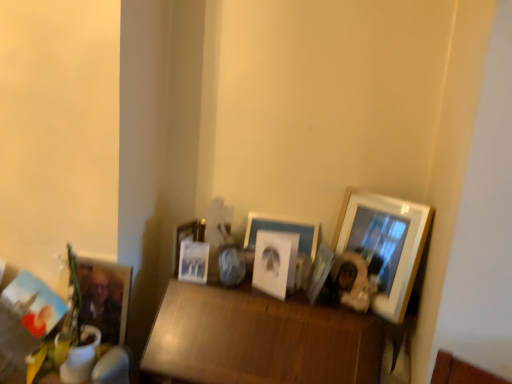
Question: Which direction should I rotate to face white paper at center, which is counted as the third picture frame, starting from the right, — up or down?

Choices:
 (A) up
 (B) down

Answer: (B)

Question: From the image's perspective, is metallic silver photo frame at center, the 5th picture frame positioned from the right, located beneath wooden picture frame at right, arranged as the 8th picture frame when viewed from the left?

Choices:
 (A) yes
 (B) no

Answer: (A)

Question: Is metallic silver photo frame at center, the 5th picture frame positioned from the right, oriented towards wooden picture frame at right, which appears as the 1th picture frame when viewed from the right?

Choices:
 (A) no
 (B) yes

Answer: (A)

Question: Is metallic silver photo frame at center, the 5th picture frame positioned from the right, in contact with wooden picture frame at right, arranged as the 8th picture frame when viewed from the left?

Choices:
 (A) yes
 (B) no

Answer: (B)

Question: Does metallic silver photo frame at center, the 5th picture frame positioned from the right, appear on the left side of wooden picture frame at right, arranged as the 8th picture frame when viewed from the left?

Choices:
 (A) no
 (B) yes

Answer: (B)

Question: From the image's perspective, is metallic silver photo frame at center, acting as the 4th picture frame starting from the left, over wooden picture frame at right, which appears as the 1th picture frame when viewed from the right?

Choices:
 (A) yes
 (B) no

Answer: (B)

Question: Can you confirm if metallic silver photo frame at center, the 5th picture frame positioned from the right, is bigger than wooden picture frame at right, arranged as the 8th picture frame when viewed from the left?

Choices:
 (A) yes
 (B) no

Answer: (B)

Question: From a real-world perspective, is wooden picture frame at right, arranged as the 8th picture frame when viewed from the left, beneath matte black picture frame at lower left, placed as the first picture frame when sorted from left to right?

Choices:
 (A) no
 (B) yes

Answer: (A)

Question: Is wooden picture frame at right, arranged as the 8th picture frame when viewed from the left, closer to camera compared to matte black picture frame at lower left, the 8th picture frame positioned from the right?

Choices:
 (A) no
 (B) yes

Answer: (B)

Question: From the image's perspective, is wooden picture frame at right, which appears as the 1th picture frame when viewed from the right, on matte black picture frame at lower left, placed as the first picture frame when sorted from left to right?

Choices:
 (A) yes
 (B) no

Answer: (A)

Question: Is wooden picture frame at right, arranged as the 8th picture frame when viewed from the left, oriented away from matte black picture frame at lower left, the 8th picture frame positioned from the right?

Choices:
 (A) yes
 (B) no

Answer: (B)

Question: Is wooden picture frame at right, which appears as the 1th picture frame when viewed from the right, next to matte black picture frame at lower left, placed as the first picture frame when sorted from left to right?

Choices:
 (A) yes
 (B) no

Answer: (B)

Question: Considering the relative sizes of wooden picture frame at right, which appears as the 1th picture frame when viewed from the right, and matte black picture frame at lower left, placed as the first picture frame when sorted from left to right, in the image provided, is wooden picture frame at right, which appears as the 1th picture frame when viewed from the right, taller than matte black picture frame at lower left, placed as the first picture frame when sorted from left to right,?

Choices:
 (A) yes
 (B) no

Answer: (A)

Question: Is matte white picture frame at center, positioned as the sixth picture frame in right-to-left order, far away from matte wooden picture frame at lower left, which appears as the seventh picture frame when viewed from the right?

Choices:
 (A) no
 (B) yes

Answer: (A)